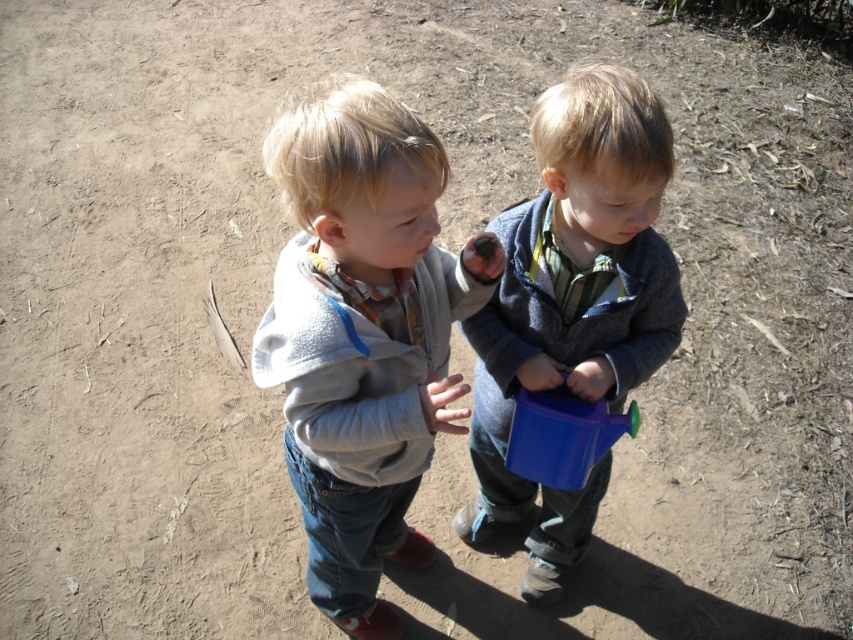
You are a parent trying to pack a backpack for a short outdoor trip. You have both the light gray fleece jacket at center and the blue plastic watering can at center. Which item should you place first into the backpack to maximize space efficiency?

The light gray fleece jacket at center is bigger than the blue plastic watering can at center, so you should place the light gray fleece jacket at center first to maximize space efficiency by putting larger items in first.